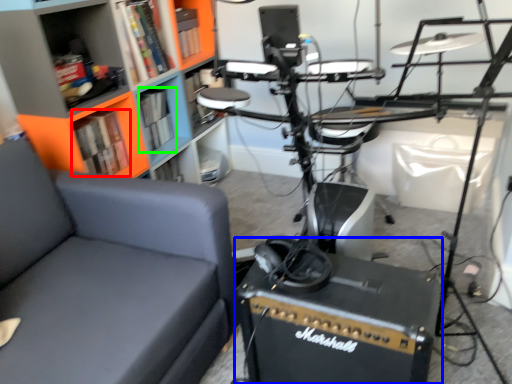
Question: Which object is the farthest from book (highlighted by a red box)? Choose among these: equipment (highlighted by a blue box) or book (highlighted by a green box).

Choices:
 (A) equipment
 (B) book

Answer: (A)